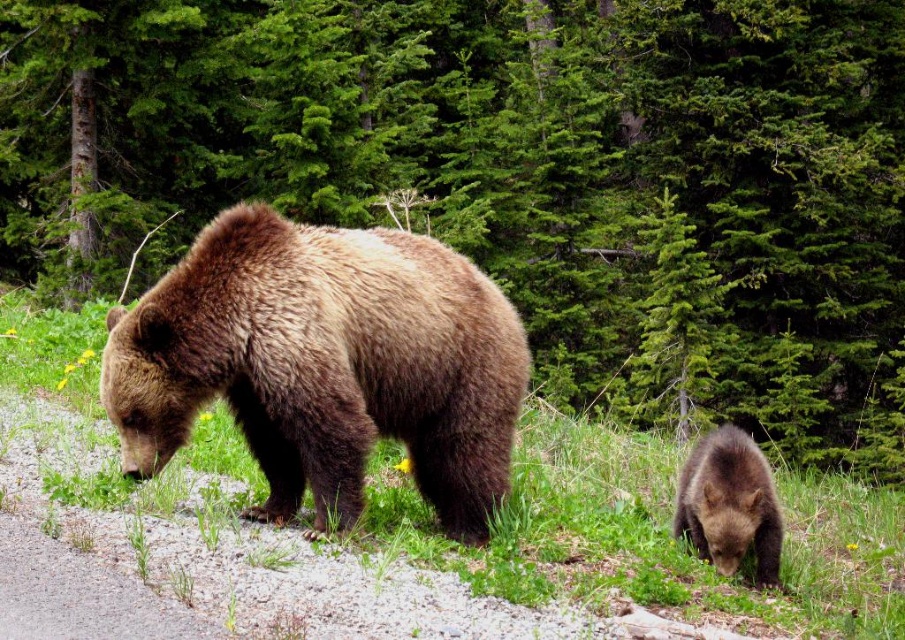
You are a hiker who wants to cross the green soft grass at center without getting your shoes dirty. Can you step over the brown furry bear at lower right to avoid the grass?

The green soft grass at center is taller than the brown furry bear at lower right. Therefore, stepping over the brown furry bear at lower right would not help you avoid the grass since the grass is taller than the bear.

You are a hiker who wants to take a photo of the brown furry bear at lower right without stepping on the green soft grass at center. Can you do that?

The green soft grass at center is in front of the brown furry bear at lower right, so you can position yourself behind the grass to take the photo without stepping on it while still capturing the bear in the frame.